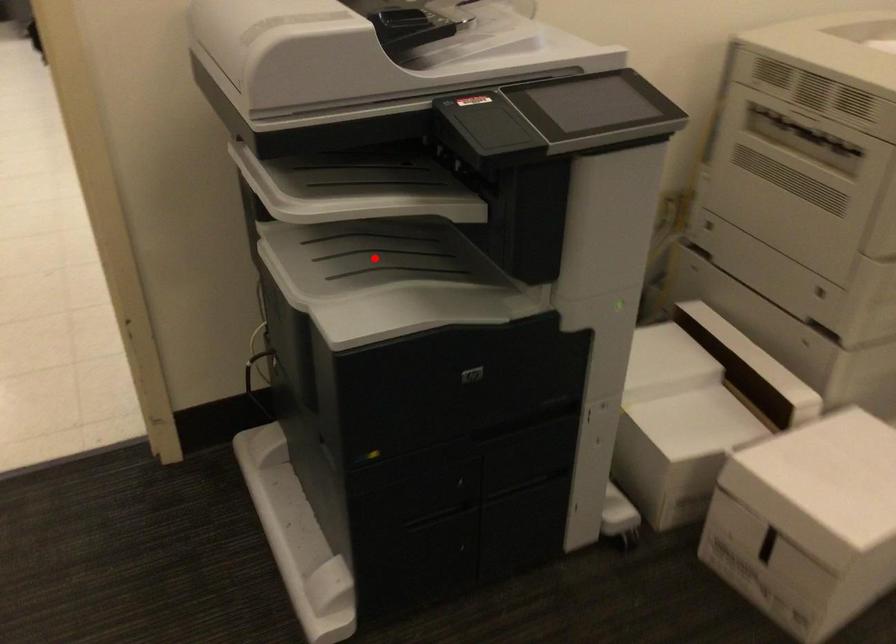
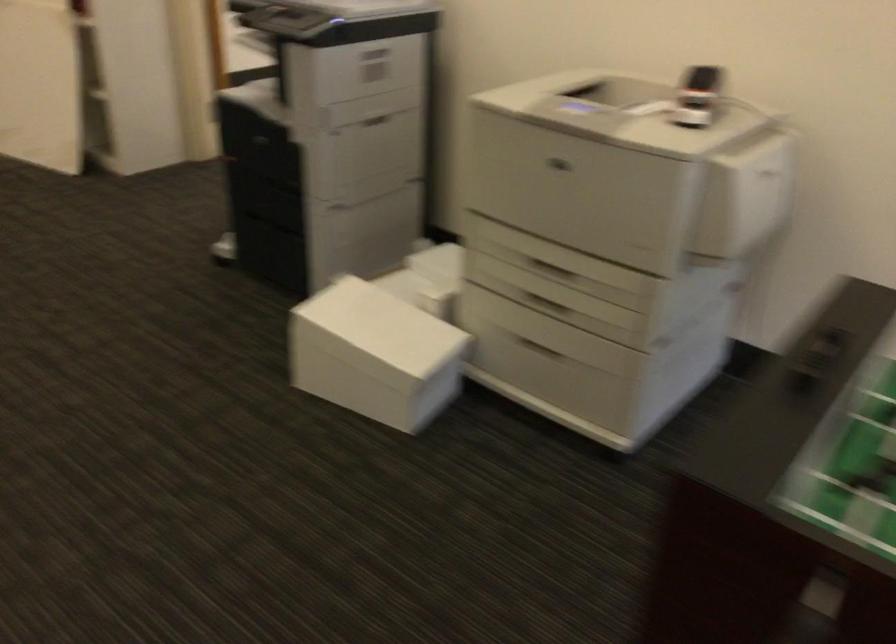
Question: I am providing you with two images of the same scene from different viewpoints. A red point is marked on the first image. At the location where the point appears in image 1, is it still visible in image 2?

Choices:
 (A) Yes
 (B) No

Answer: (B)